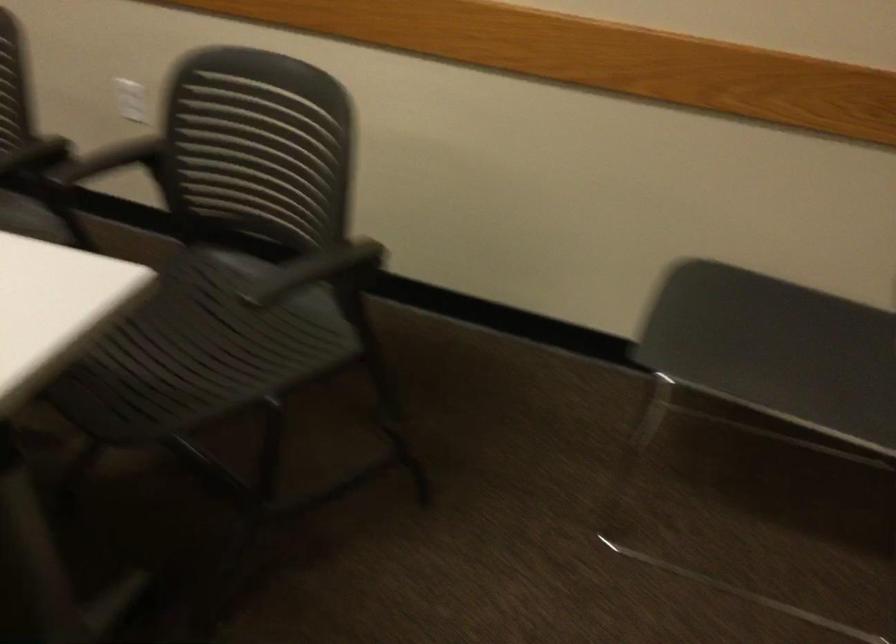
Locate an element on the screen. The image size is (896, 644). black chair armrest is located at coordinates (35, 156).